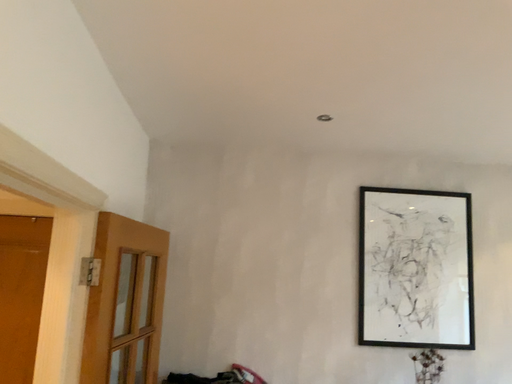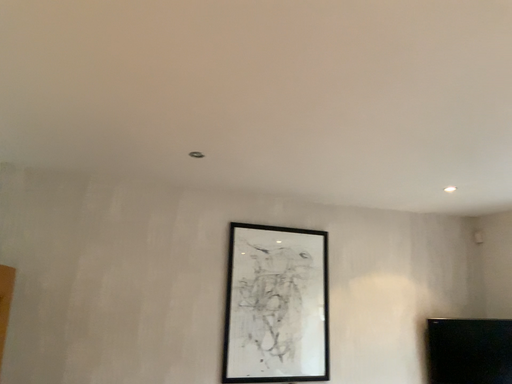
Question: How did the camera likely rotate when shooting the video?

Choices:
 (A) rotated right
 (B) rotated left

Answer: (A)